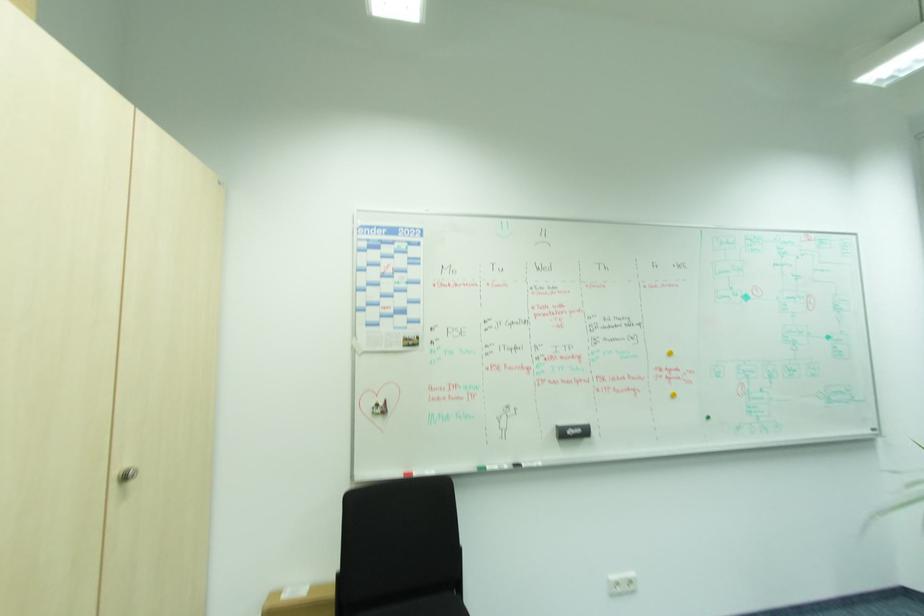
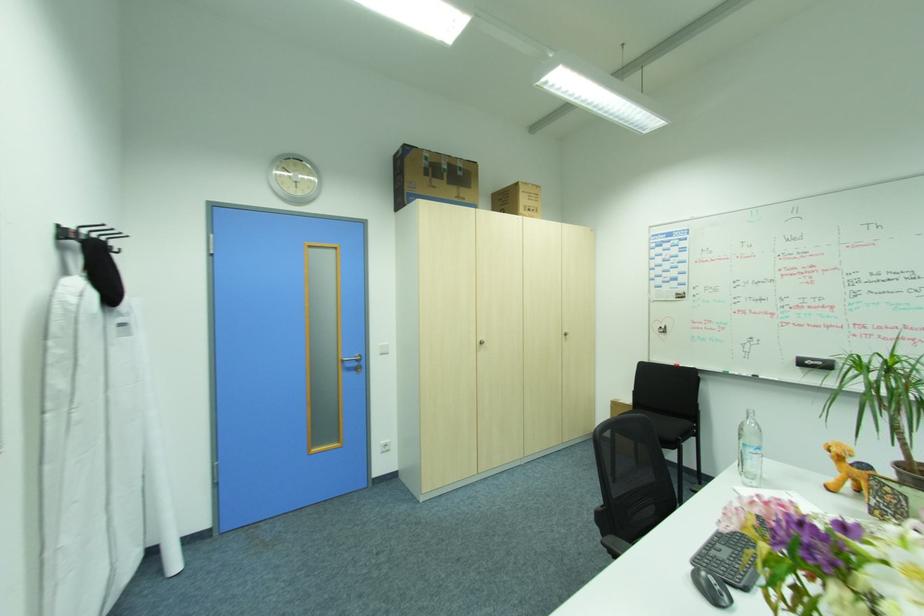
Find the pixel in the second image that matches (584,430) in the first image.

(824, 363)